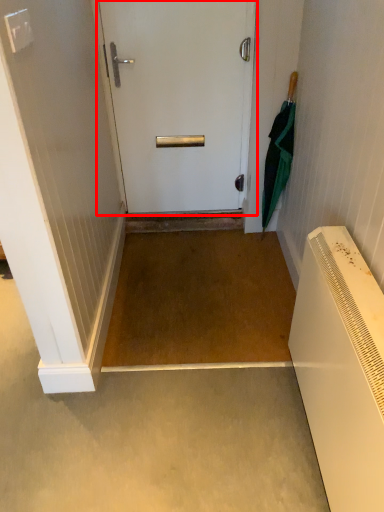
Question: From the image's perspective, where is door (annotated by the red box) located in relation to umbrella in the image?

Choices:
 (A) below
 (B) above

Answer: (B)